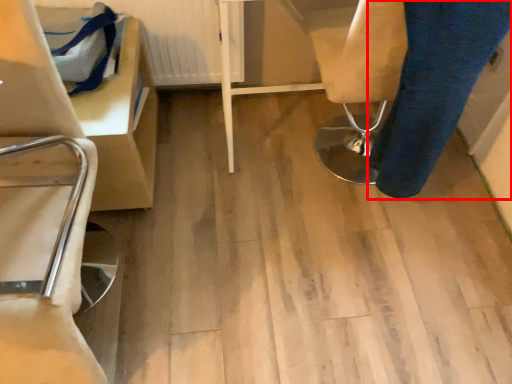
Question: From the image's perspective, where is trousers (annotated by the red box) located relative to radiator?

Choices:
 (A) above
 (B) below

Answer: (B)